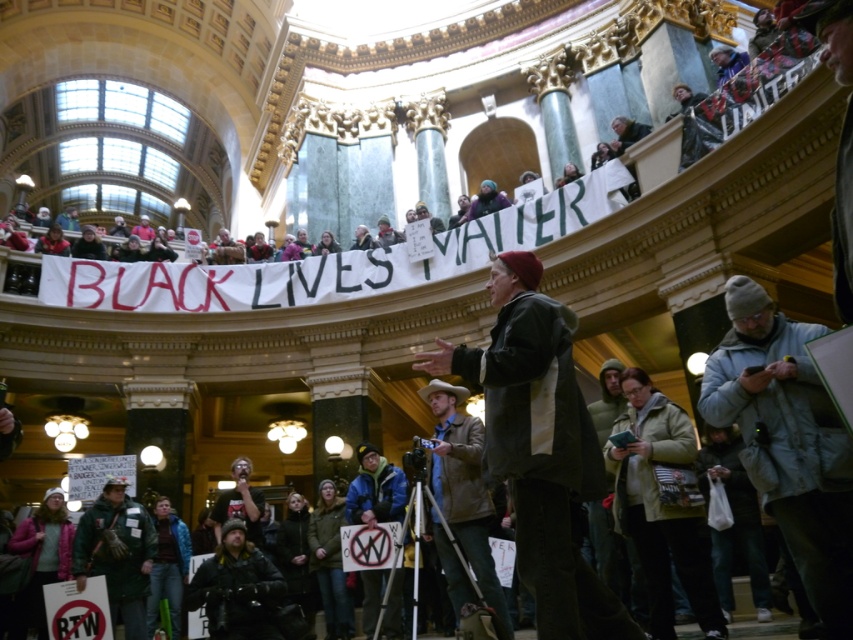
You are a photographer trying to capture the speaker at the protest. You have a camera on a tripod placed to the left of the speaker. To get a clear shot of the dark gray jacket at center, do you need to adjust the camera angle upwards or downwards compared to the camouflage jacket at lower left?

The dark gray jacket at center is above the camouflage jacket at lower left, so to capture the dark gray jacket at center, you need to adjust the camera angle upwards from the camouflage jacket at lower left.

You are a photographer trying to capture the dark gray jacket at center and the camouflage jacket at lower left in the same frame. Can you position yourself so that both jackets are visible without one blocking the other?

The dark gray jacket at center is in front of the camouflage jacket at lower left, so you cannot position yourself to capture both jackets without one blocking the other.